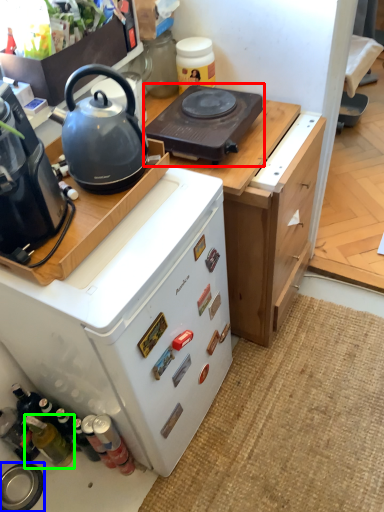
Question: Which object is the farthest from gas stove (highlighted by a red box)? Choose among these: kitchen appliance (highlighted by a blue box) or bottle (highlighted by a green box).

Choices:
 (A) kitchen appliance
 (B) bottle

Answer: (A)